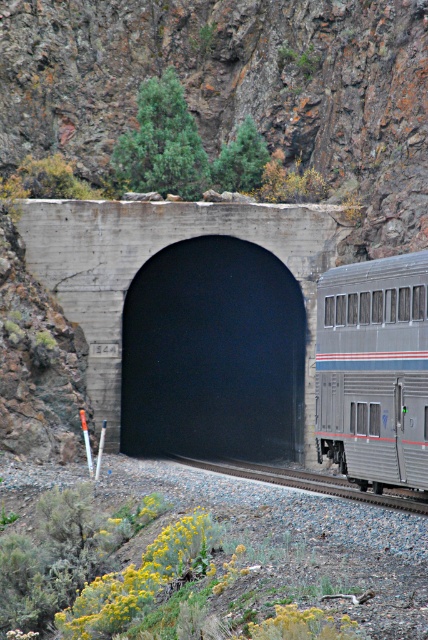
You are a passenger on the silver metallic train car at center. As the train exits the black concrete tunnel at center, you look out the window. Which direction is the tunnel entrance relative to your current position?

The black concrete tunnel at center is located below the silver metallic train car at center, so the tunnel entrance is below your current position as you exit it.